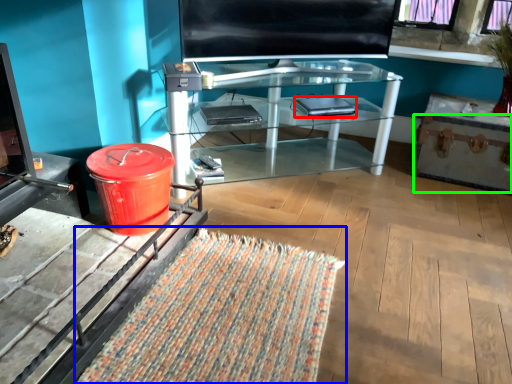
Question: Which object is the closest to the laptop (highlighted by a red box)? Choose among these: mat (highlighted by a blue box) or drawer (highlighted by a green box).

Choices:
 (A) mat
 (B) drawer

Answer: (B)